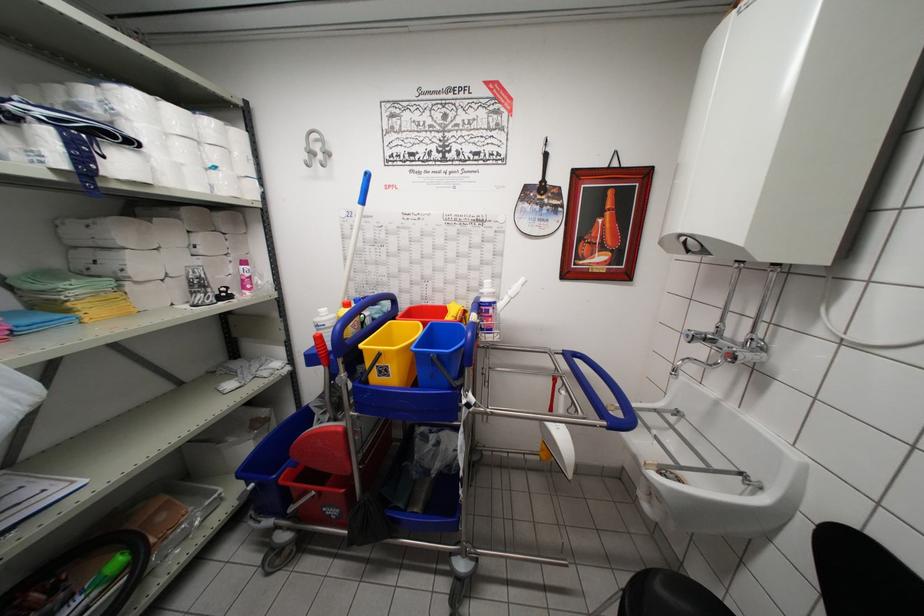
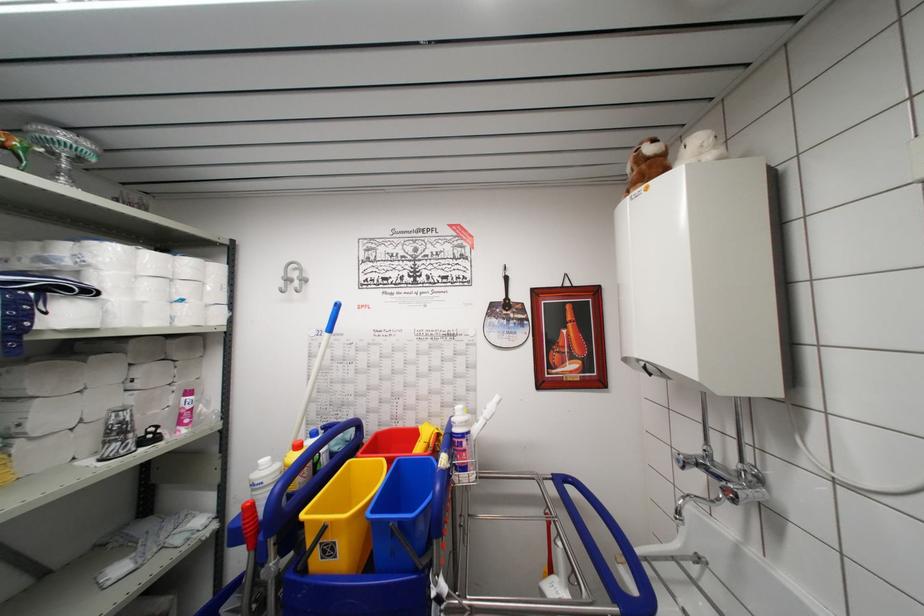
Find the pixel in the second image that matches point 382,381 in the first image.

(325, 562)